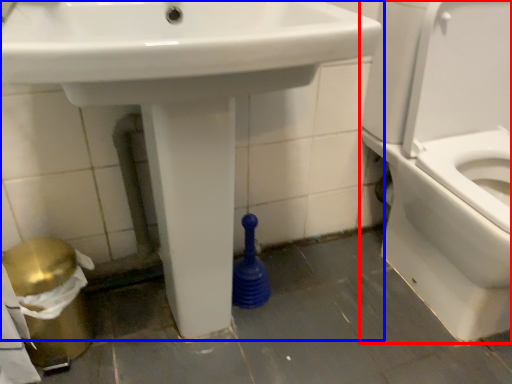
Question: Which object is further to the camera taking this photo, toilet (highlighted by a red box) or sink (highlighted by a blue box)?

Choices:
 (A) toilet
 (B) sink

Answer: (A)